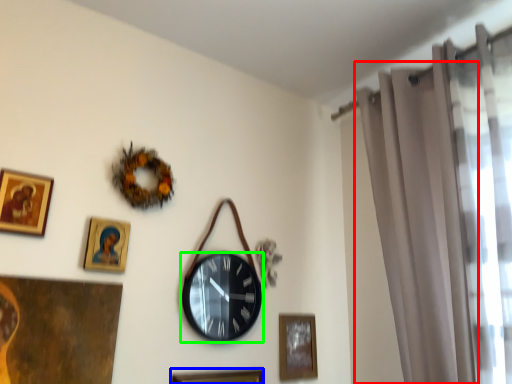
Question: Which object is positioned farthest from curtain (highlighted by a red box)? Select from picture frame (highlighted by a blue box) and wall clock (highlighted by a green box).

Choices:
 (A) picture frame
 (B) wall clock

Answer: (A)